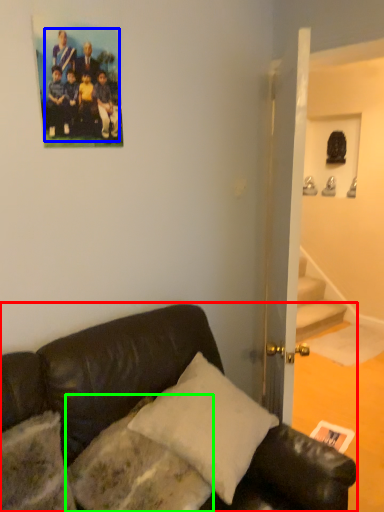
Question: Which object is the farthest from studio couch (highlighted by a red box)? Choose among these: football team (highlighted by a blue box) or pillow (highlighted by a green box).

Choices:
 (A) football team
 (B) pillow

Answer: (A)